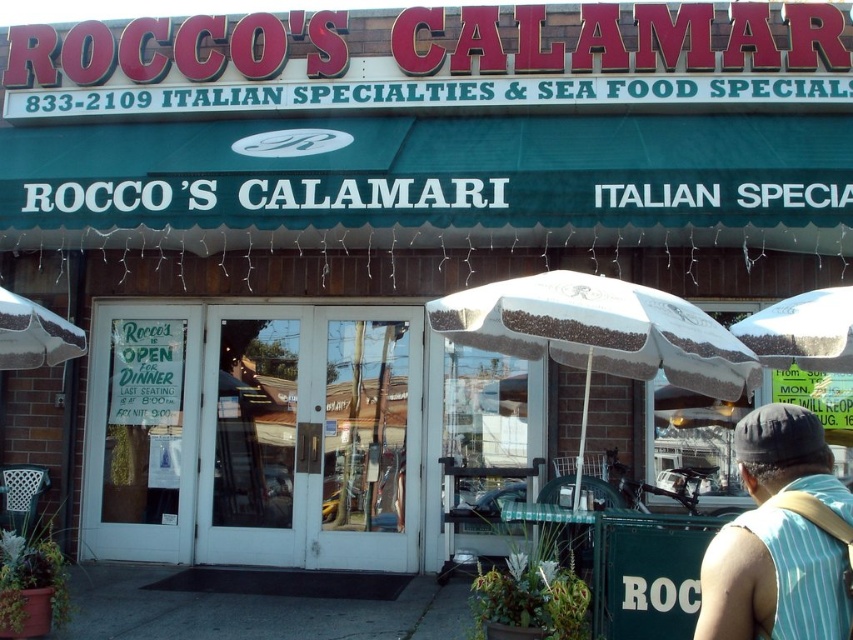
Question: Can you confirm if white textured umbrella at center is positioned to the right of white fabric umbrella at center?

Choices:
 (A) yes
 (B) no

Answer: (B)

Question: Considering the real-world distances, which object is farthest from the white fabric umbrella at center?

Choices:
 (A) white textured umbrella at center
 (B) striped sleeveless shirt at lower right

Answer: (B)

Question: Can you confirm if white textured umbrella at center is smaller than white textured umbrella at left?

Choices:
 (A) yes
 (B) no

Answer: (B)

Question: Is the position of striped sleeveless shirt at lower right more distant than that of white textured umbrella at left?

Choices:
 (A) yes
 (B) no

Answer: (B)

Question: Among these points, which one is farthest from the camera?

Choices:
 (A) (15, 304)
 (B) (743, 544)
 (C) (808, 371)

Answer: (A)

Question: Which point appears farthest from the camera in this image?

Choices:
 (A) (729, 385)
 (B) (844, 344)

Answer: (A)